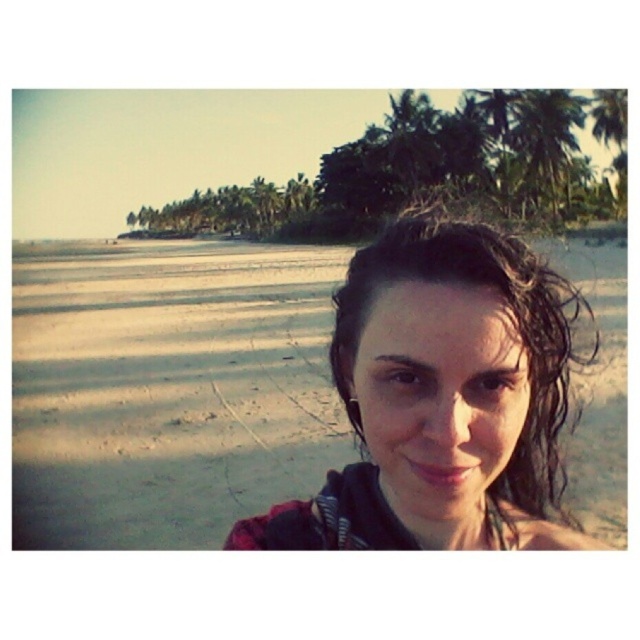
This screenshot has height=640, width=640. I want to click on wet hair at center, so click(x=442, y=397).

Who is shorter, wet hair at center or green leafy palm tree at upper right?

Standing shorter between the two is wet hair at center.

Locate an element on the screen. Image resolution: width=640 pixels, height=640 pixels. wet hair at center is located at coordinates (442, 397).

The image size is (640, 640). What are the coordinates of `wet hair at center` in the screenshot? It's located at (442, 397).